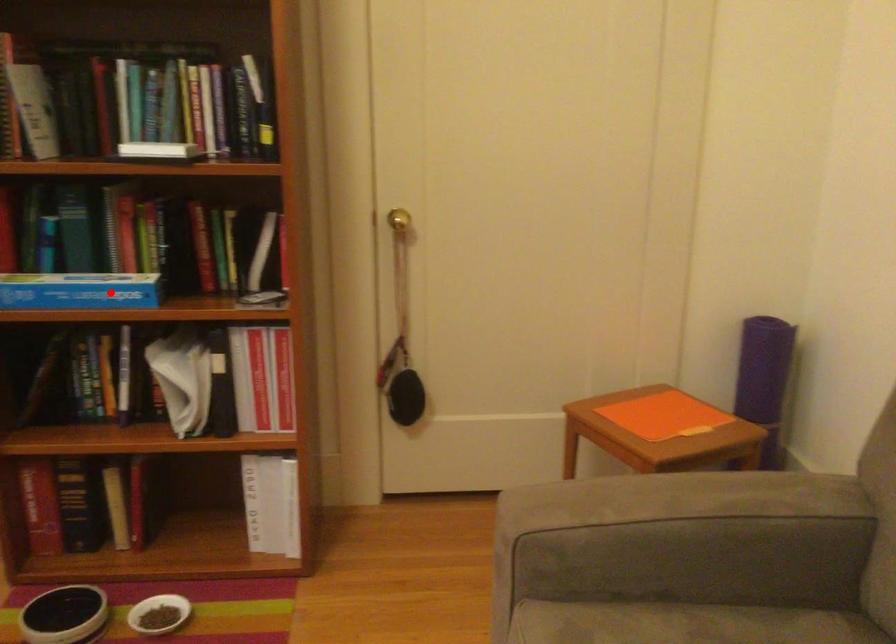
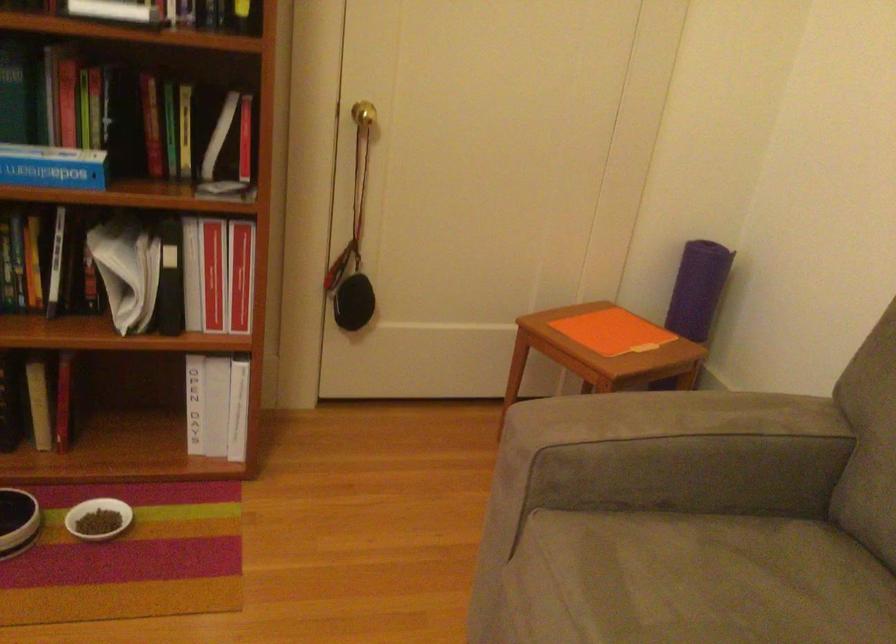
In the second image, find the point that corresponds to the highlighted location in the first image.

(53, 167)